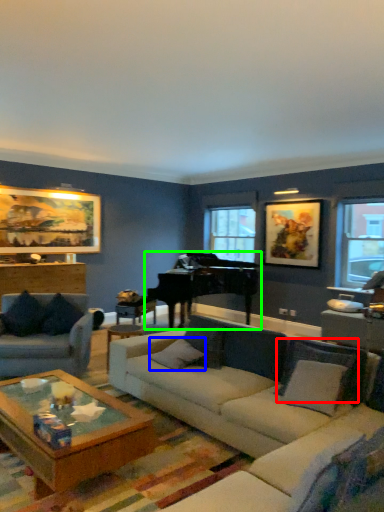
Question: Which object is positioned closest to pillow (highlighted by a red box)? Select from pillow (highlighted by a blue box) and piano (highlighted by a green box).

Choices:
 (A) pillow
 (B) piano

Answer: (A)